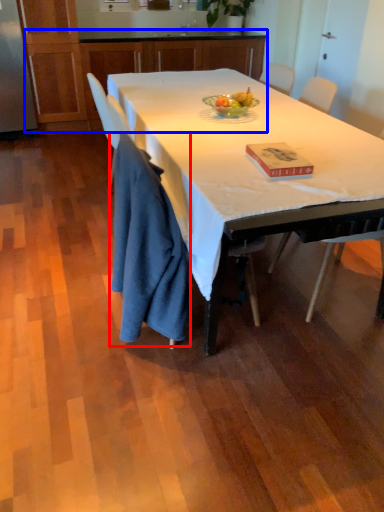
Question: Which object appears farthest to the camera in this image, cloth (highlighted by a red box) or cabinetry (highlighted by a blue box)?

Choices:
 (A) cloth
 (B) cabinetry

Answer: (B)